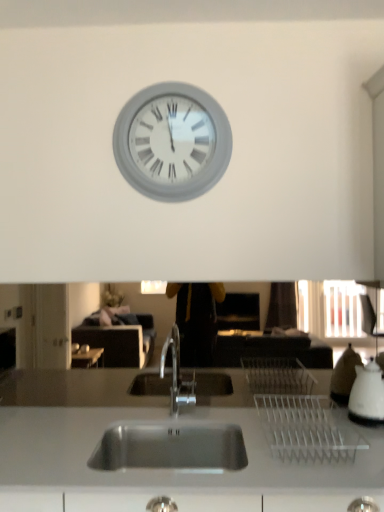
Question: Based on their sizes in the image, would you say white glossy kettle at right is bigger or smaller than white matte clock at upper center?

Choices:
 (A) big
 (B) small

Answer: (B)

Question: From a real-world perspective, is white glossy kettle at right positioned above or below white matte clock at upper center?

Choices:
 (A) above
 (B) below

Answer: (B)

Question: Visually, is white glossy kettle at right positioned to the left or to the right of white matte clock at upper center?

Choices:
 (A) right
 (B) left

Answer: (A)

Question: Is point pyautogui.click(x=147, y=189) positioned closer to the camera than point pyautogui.click(x=357, y=415)?

Choices:
 (A) closer
 (B) farther

Answer: (B)

Question: Looking at their shapes, would you say white matte clock at upper center is wider or thinner than white glossy kettle at right?

Choices:
 (A) thin
 (B) wide

Answer: (A)

Question: From the image's perspective, relative to white glossy kettle at right, is white matte clock at upper center above or below?

Choices:
 (A) below
 (B) above

Answer: (B)

Question: From a real-world perspective, is white matte clock at upper center positioned above or below white glossy kettle at right?

Choices:
 (A) below
 (B) above

Answer: (B)